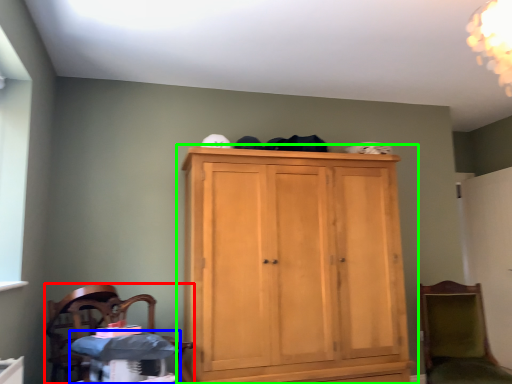
Question: Which object is positioned closest to chair (highlighted by a red box)? Select from changing table (highlighted by a blue box) and cupboard (highlighted by a green box).

Choices:
 (A) changing table
 (B) cupboard

Answer: (A)